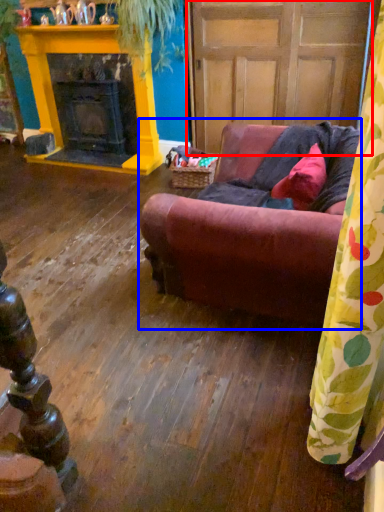
Question: Among these objects, which one is nearest to the camera, door (highlighted by a red box) or studio couch (highlighted by a blue box)?

Choices:
 (A) door
 (B) studio couch

Answer: (B)